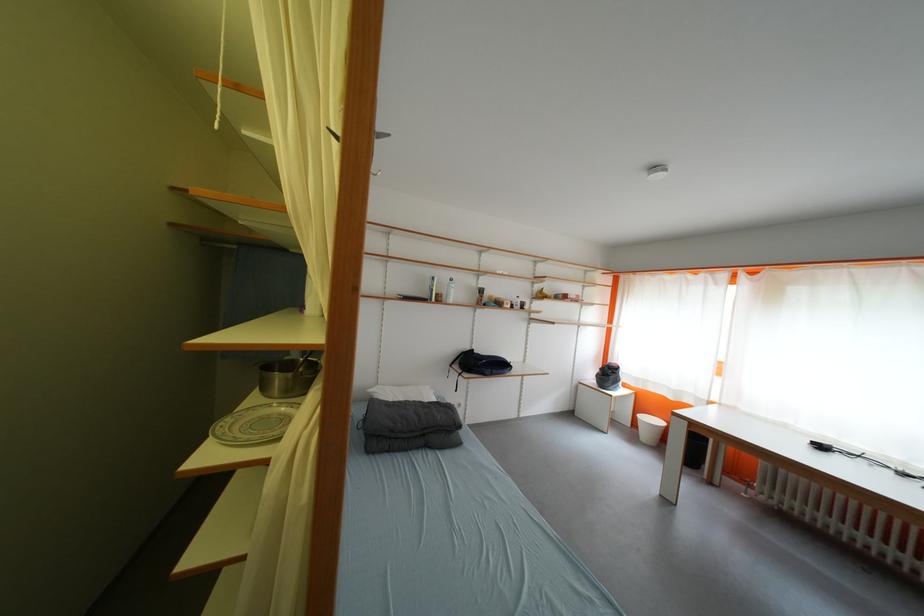
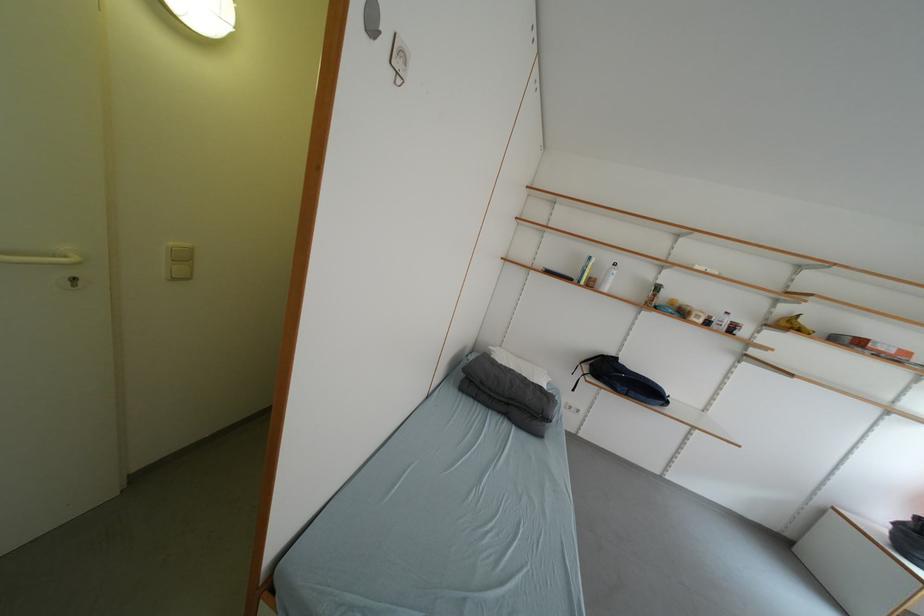
Find the pixel in the second image that matches pixel 550 299 in the first image.

(797, 328)